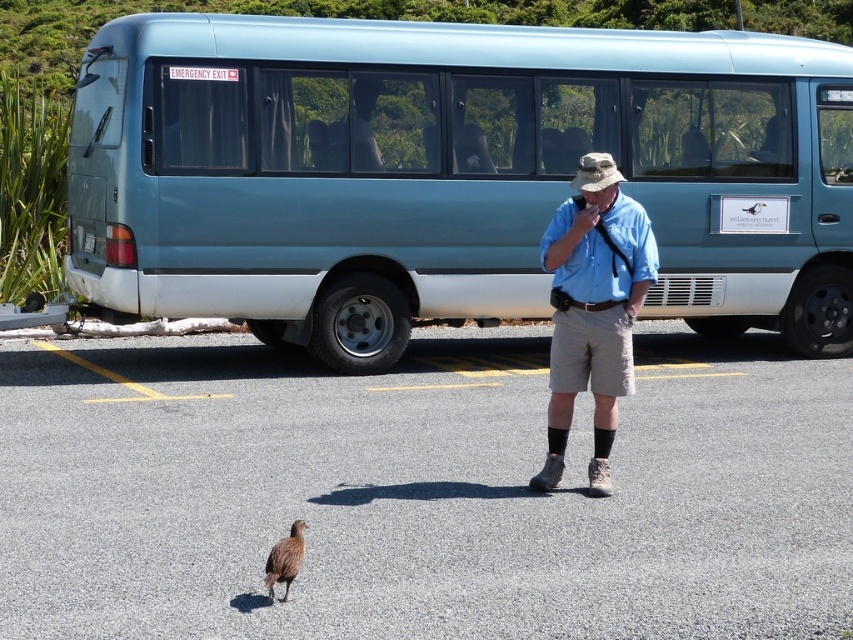
At what (x,y) coordinates should I click in order to perform the action: click on gray asphalt parking lot at center. Please return your answer as a coordinate pair (x, y). The height and width of the screenshot is (640, 853). Looking at the image, I should click on (421, 492).

Is gray asphalt parking lot at center in front of teal matte bus at upper center?

Yes, gray asphalt parking lot at center is closer to the viewer.

Is point (682, 381) in front of point (630, 81)?

That is True.

What are the coordinates of `gray asphalt parking lot at center` in the screenshot? It's located at (421, 492).

Is point (492, 552) behind point (274, 548)?

Yes, point (492, 552) is behind point (274, 548).

Between point (793, 492) and point (291, 538), which one is positioned in front?

Point (291, 538)

The width and height of the screenshot is (853, 640). What do you see at coordinates (421, 492) in the screenshot? I see `gray asphalt parking lot at center` at bounding box center [421, 492].

The image size is (853, 640). Find the location of `gray asphalt parking lot at center`. gray asphalt parking lot at center is located at coordinates (421, 492).

Can you confirm if teal matte bus at upper center is wider than blue cotton shirt at center?

In fact, teal matte bus at upper center might be narrower than blue cotton shirt at center.

Is teal matte bus at upper center thinner than blue cotton shirt at center?

Indeed, teal matte bus at upper center has a lesser width compared to blue cotton shirt at center.

Where is `teal matte bus at upper center`? teal matte bus at upper center is located at coordinates (450, 173).